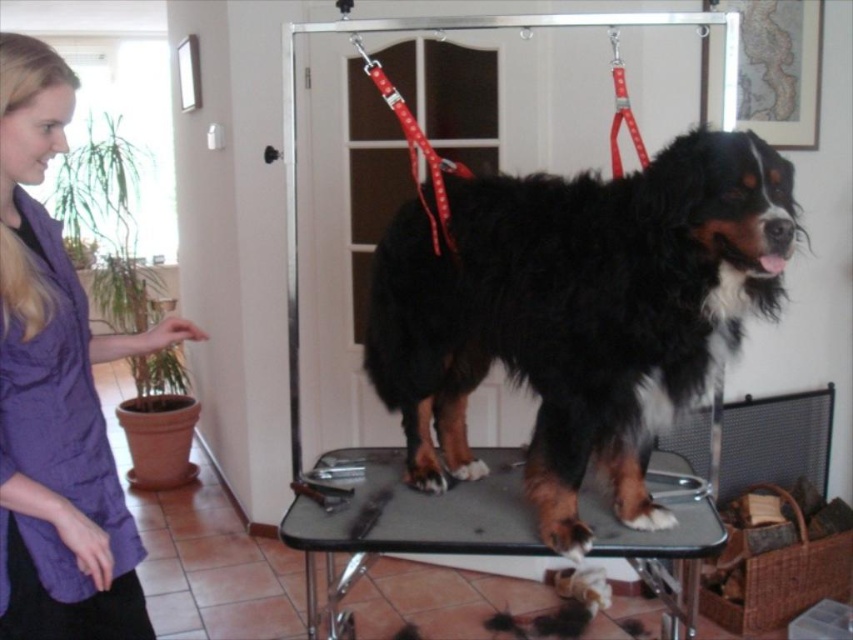
You are a groomer trying to place a new set of grooming tools on the table. Considering the current arrangement, can you fit them on the metallic gray grooming table at center without moving the black shaggy dog at center?

The black shaggy dog at center occupies less space than the metallic gray grooming table at center, so there is likely enough room to place the new set of grooming tools without moving the dog.

You are a groomer trying to put a purple fabric shirt on the black shaggy dog at center. Based on their sizes, will the purple fabric shirt at left fit over the dog?

The black shaggy dog at center is not as tall as the purple fabric shirt at left, so the shirt should fit over the dog since it is taller than the dog.